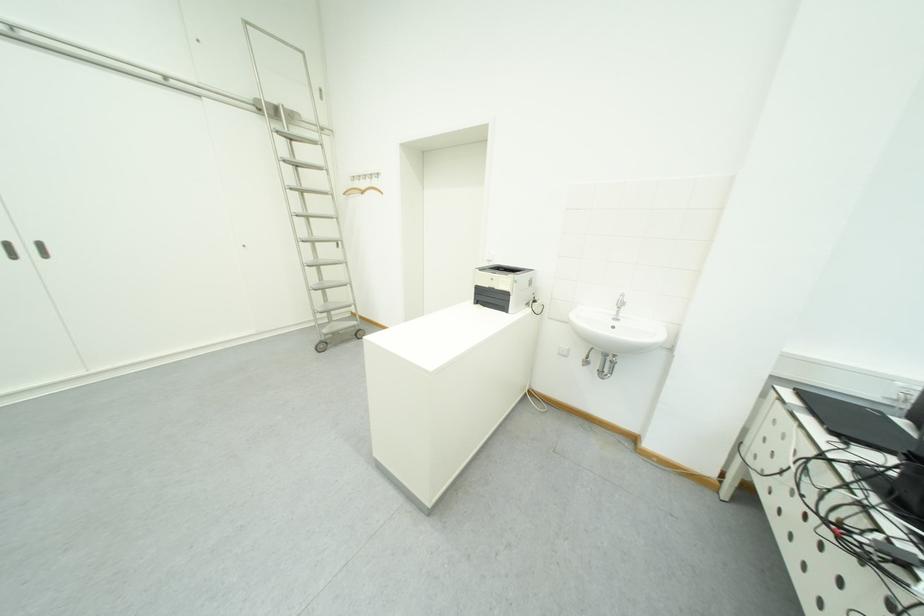
Where is `laptop lid`? The width and height of the screenshot is (924, 616). laptop lid is located at coordinates (856, 423).